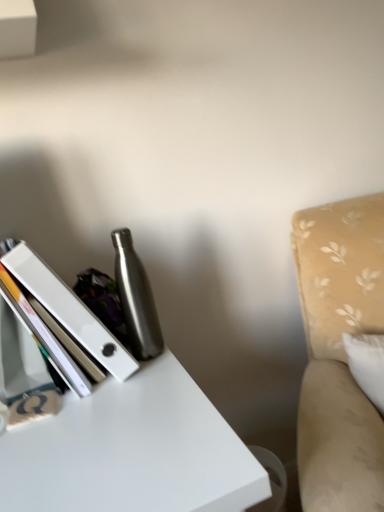
Question: Can you confirm if beige fabric swivel chair at right is positioned to the left of white glossy book at left?

Choices:
 (A) yes
 (B) no

Answer: (B)

Question: Is beige fabric swivel chair at right beside white glossy book at left?

Choices:
 (A) no
 (B) yes

Answer: (A)

Question: Does beige fabric swivel chair at right turn towards white glossy book at left?

Choices:
 (A) no
 (B) yes

Answer: (A)

Question: Is white glossy book at left located within beige fabric swivel chair at right?

Choices:
 (A) no
 (B) yes

Answer: (A)

Question: Can you confirm if beige fabric swivel chair at right is shorter than white glossy book at left?

Choices:
 (A) no
 (B) yes

Answer: (A)

Question: Is beige fabric swivel chair at right behind white glossy book at left?

Choices:
 (A) yes
 (B) no

Answer: (B)

Question: Considering the relative sizes of brushed metal water bottle at center and white glossy book at left in the image provided, is brushed metal water bottle at center bigger than white glossy book at left?

Choices:
 (A) no
 (B) yes

Answer: (A)

Question: Is the depth of brushed metal water bottle at center less than that of white glossy book at left?

Choices:
 (A) yes
 (B) no

Answer: (B)

Question: Is brushed metal water bottle at center not inside white glossy book at left?

Choices:
 (A) no
 (B) yes

Answer: (B)

Question: Does brushed metal water bottle at center appear on the right side of white glossy book at left?

Choices:
 (A) yes
 (B) no

Answer: (A)

Question: Is white glossy book at left located within brushed metal water bottle at center?

Choices:
 (A) yes
 (B) no

Answer: (B)

Question: Can you confirm if brushed metal water bottle at center is wider than white glossy book at left?

Choices:
 (A) yes
 (B) no

Answer: (B)

Question: Is white glossy book at left smaller than beige fabric swivel chair at right?

Choices:
 (A) yes
 (B) no

Answer: (A)